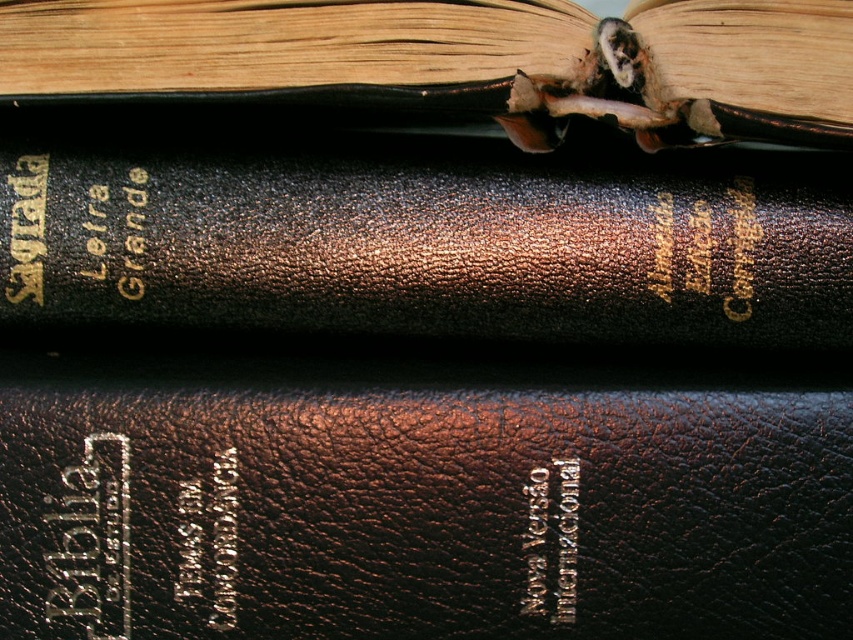
You are standing 1 meter away from the stack of books. You want to reach a point that is exactly 74.70 centimeters away from the camera. Is the point at (752, 264) within your reach?

The point at (752, 264) is 74.70 centimeters away from the camera. Since you are standing 1 meter away from the stack of books, which is approximately 100 centimeters, the point is within your reach as it is closer than your current distance.

You are a librarian who needs to place a book on the shelf. The shelf is 70 cm away from where you are standing. You have a brown leather book at center in your hand. Can you place it on the shelf without moving your position?

The brown leather book at center and viewer are 68.63 centimeters apart from each other. Since the shelf is 70 cm away, you can place the brown leather book at center on the shelf without moving your position because the distance between you and the shelf is sufficient.